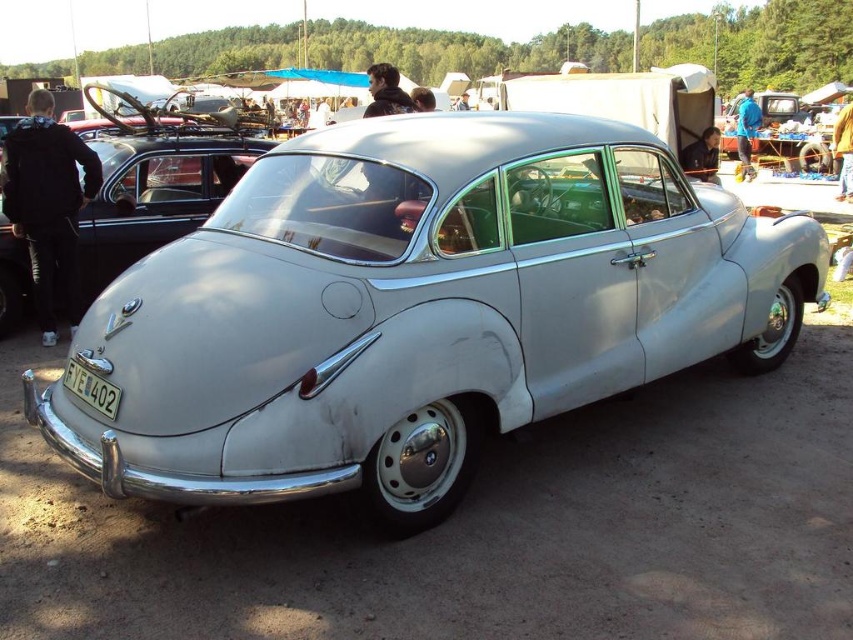
Question: Can you confirm if satin silver car at center is positioned to the left of white plastic license plate at lower center?

Choices:
 (A) no
 (B) yes

Answer: (A)

Question: Is satin silver car at center above white plastic license plate at lower center?

Choices:
 (A) yes
 (B) no

Answer: (A)

Question: Considering the relative positions of satin silver car at center and white plastic license plate at lower center in the image provided, where is satin silver car at center located with respect to white plastic license plate at lower center?

Choices:
 (A) left
 (B) right

Answer: (B)

Question: Which point is closer to the camera?

Choices:
 (A) (88, 380)
 (B) (410, 115)

Answer: (A)

Question: Which object appears closest to the camera in this image?

Choices:
 (A) white plastic license plate at lower center
 (B) satin silver car at center

Answer: (B)